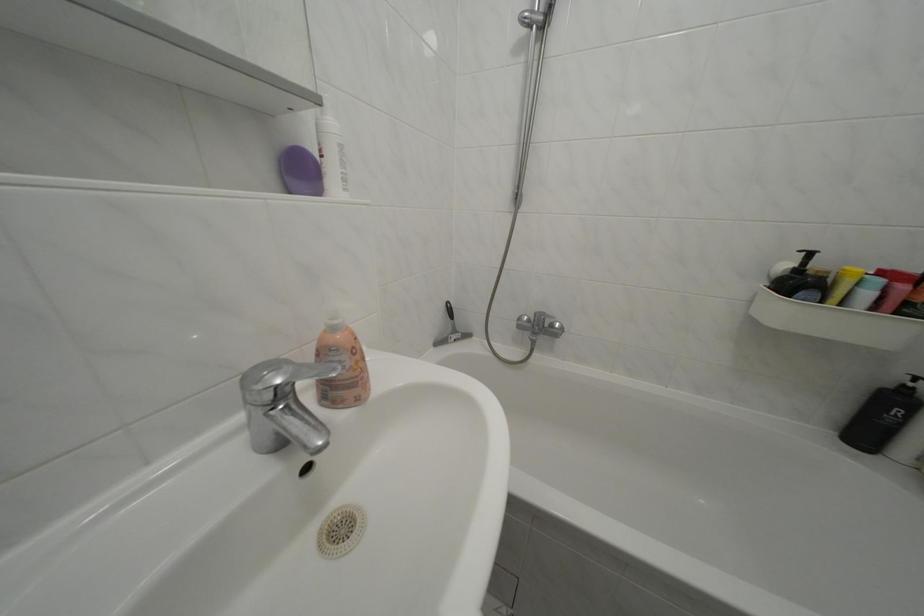
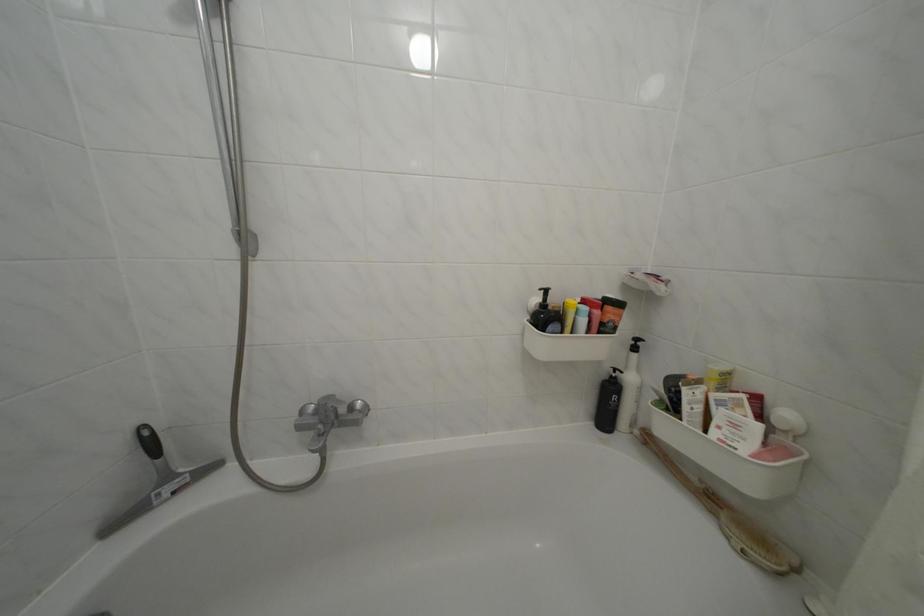
Question: How did the camera likely rotate?

Choices:
 (A) Left
 (B) Right
 (C) Up
 (D) Down

Answer: (B)